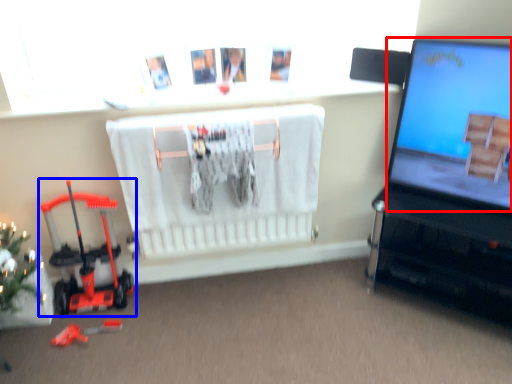
Question: Which of the following is the farthest to the observer, computer screen (highlighted by a red box) or toy (highlighted by a blue box)?

Choices:
 (A) computer screen
 (B) toy

Answer: (B)